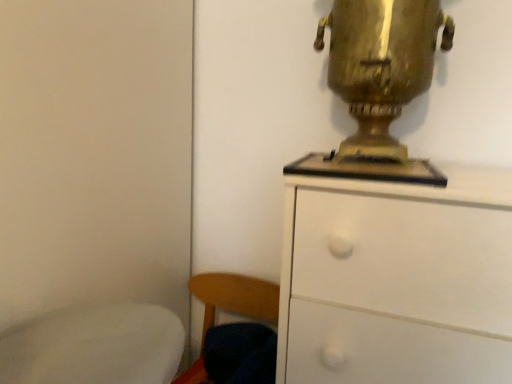
Question: Does point (333, 230) appear closer or farther from the camera than point (410, 57)?

Choices:
 (A) farther
 (B) closer

Answer: (B)

Question: From their relative heights in the image, would you say white matte chest of drawers at upper right is taller or shorter than gold metallic samovar at upper right?

Choices:
 (A) tall
 (B) short

Answer: (A)

Question: Which of these objects is positioned farthest from the gold metallic samovar at upper right?

Choices:
 (A) wooden chair at lower left
 (B) white matte chest of drawers at upper right

Answer: (A)

Question: Which is nearer to the white matte chest of drawers at upper right?

Choices:
 (A) gold metallic samovar at upper right
 (B) wooden chair at lower left

Answer: (A)